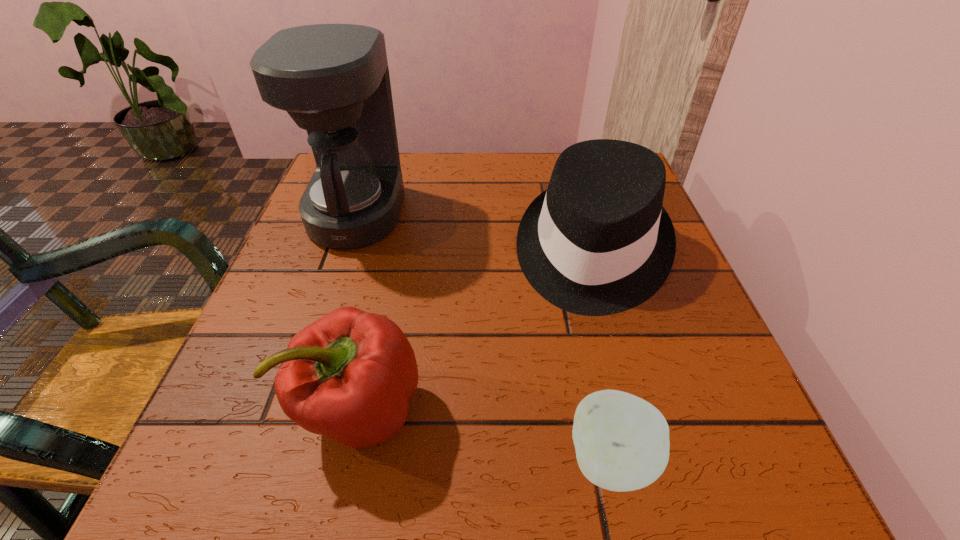
The image size is (960, 540). In order to click on coffee maker in this screenshot , I will do `click(333, 80)`.

Where is `fedora`? The height and width of the screenshot is (540, 960). fedora is located at coordinates (598, 241).

The height and width of the screenshot is (540, 960). Find the location of `bell pepper`. bell pepper is located at coordinates (349, 376).

This screenshot has width=960, height=540. In order to click on apple in this screenshot , I will do `click(622, 443)`.

The width and height of the screenshot is (960, 540). I want to click on free point located 0.190m on the button side of the tallest object, so click(493, 213).

Identify the location of free space located on the left of the fedora. This screenshot has height=540, width=960. (465, 251).

At what (x,y) coordinates should I click in order to perform the action: click on blank space located 0.250m on the right of the bell pepper. Please return your answer as a coordinate pair (x, y). The width and height of the screenshot is (960, 540). Looking at the image, I should click on (603, 409).

Find the location of `free point located 0.270m on the back of the shortest object`. free point located 0.270m on the back of the shortest object is located at coordinates (572, 280).

The image size is (960, 540). What are the coordinates of `coffee maker present at the far edge` in the screenshot? It's located at (333, 80).

Locate an element on the screen. The image size is (960, 540). fedora situated at the far edge is located at coordinates (598, 241).